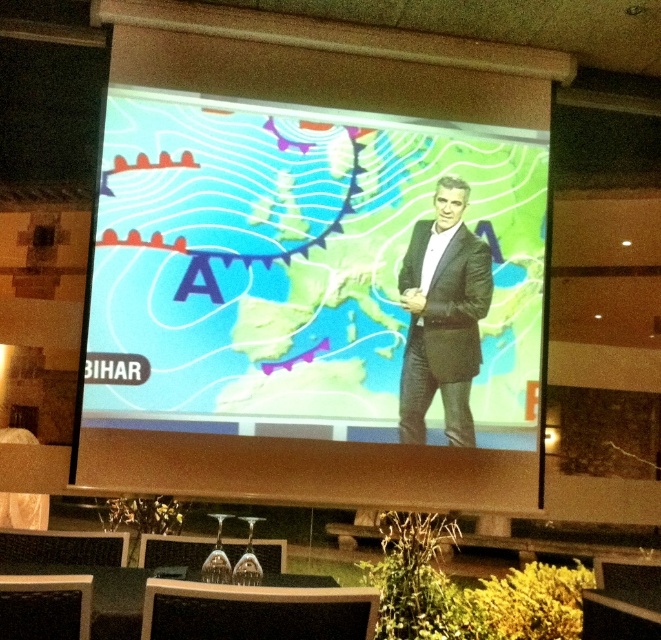
Which is below, matte plastic screen at center or dark gray suit at center?

dark gray suit at center is below.

Is point (531, 180) closer to camera compared to point (442, 385)?

No, it is not.

At what (x,y) coordinates should I click in order to perform the action: click on matte plastic screen at center. Please return your answer as a coordinate pair (x, y). Looking at the image, I should click on point(299,301).